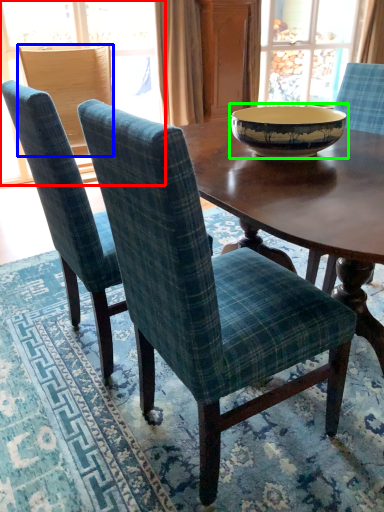
Question: Based on their relative distances, which object is nearer to window (highlighted by a red box)? Choose from chair (highlighted by a blue box) and bowl (highlighted by a green box).

Choices:
 (A) chair
 (B) bowl

Answer: (A)